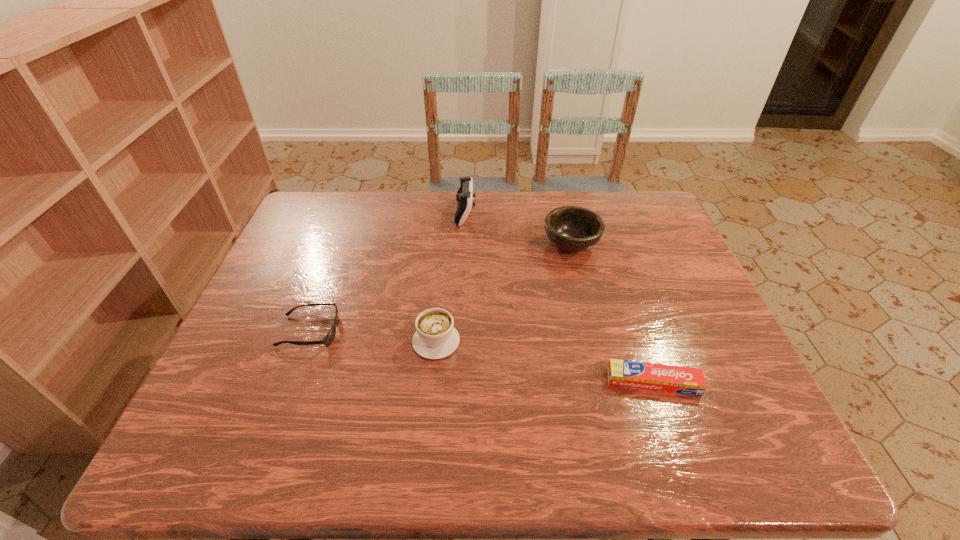
This screenshot has width=960, height=540. What are the coordinates of `control` in the screenshot? It's located at (464, 196).

Identify the location of bowl. (571, 228).

The image size is (960, 540). Identify the location of cappuccino. (435, 337).

Identify the location of the leftmost object. The width and height of the screenshot is (960, 540). (328, 339).

Locate an element on the screen. The image size is (960, 540). the nearest object is located at coordinates (684, 380).

What are the coordinates of `vacant region located on the front-facing side of the control` in the screenshot? It's located at (571, 213).

Identify the location of vacant region located 0.070m on the right of the bowl. The height and width of the screenshot is (540, 960). (624, 244).

Locate an element on the screen. The image size is (960, 540). free space located to the right of the cappuccino's handle is located at coordinates (440, 307).

You are a GUI agent. You are given a task and a screenshot of the screen. Output one action in this format:
    pyautogui.click(x=<x>, y=<y>)
    Task: Click on the free space located to the right of the cappuccino's handle
    Image resolution: width=960 pixels, height=540 pixels.
    Given the screenshot: What is the action you would take?
    pyautogui.click(x=443, y=276)

I want to click on vacant space located 0.310m to the right of the cappuccino's handle, so click(445, 241).